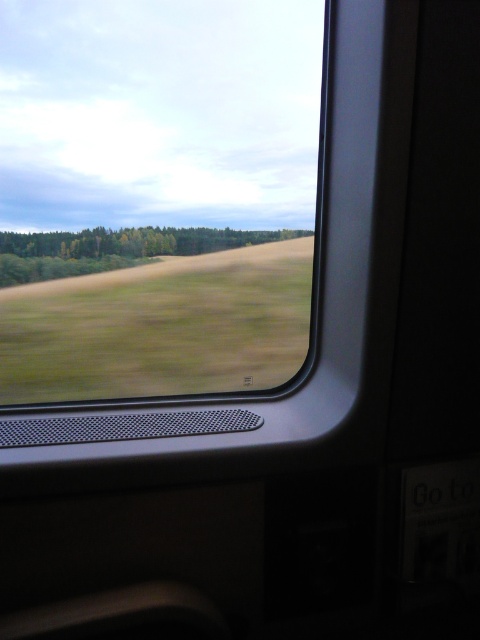
Question: Among these objects, which one is farthest from the camera?

Choices:
 (A) green matte forest at center
 (B) transparent glass window at center

Answer: (A)

Question: Is transparent glass window at center thinner than green matte forest at center?

Choices:
 (A) no
 (B) yes

Answer: (A)

Question: Does transparent glass window at center appear on the right side of green matte forest at center?

Choices:
 (A) yes
 (B) no

Answer: (B)

Question: Does transparent glass window at center have a larger size compared to green matte forest at center?

Choices:
 (A) yes
 (B) no

Answer: (A)